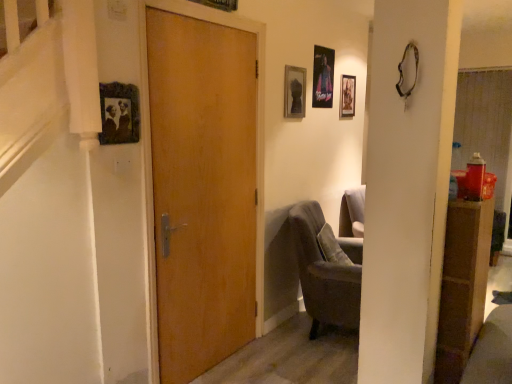
Question: From a real-world perspective, is metallic poster at upper center, acting as the fourth picture frame starting from the front, physically located above or below velvet grey armchair at lower right?

Choices:
 (A) below
 (B) above

Answer: (B)

Question: Is point (320, 96) positioned closer to the camera than point (295, 220)?

Choices:
 (A) closer
 (B) farther

Answer: (B)

Question: Which object is positioned farthest from the wooden picture frame at upper center, marked as the fourth picture frame in a back-to-front arrangement?

Choices:
 (A) matte black picture frame at upper left, arranged as the 5th picture frame when viewed from the back
 (B) metallic poster at upper center, acting as the fourth picture frame starting from the front
 (C) velvet grey armchair at lower right
 (D) matte glass picture frame at upper center, which is counted as the third picture frame, starting from the front
 (E) wooden door at center

Answer: (C)

Question: Estimate the real-world distances between objects in this image. Which object is farther from the wooden picture frame at upper center, marked as the 2th picture frame in a left-to-right arrangement?

Choices:
 (A) metallic poster at upper center, acting as the fourth picture frame starting from the front
 (B) velvet grey armchair at lower right
 (C) matte glass picture frame at upper center, which appears as the 3th picture frame when viewed from the back
 (D) matte black picture frame at upper center, the fifth picture frame in the left-to-right sequence
 (E) wooden door at center

Answer: (B)